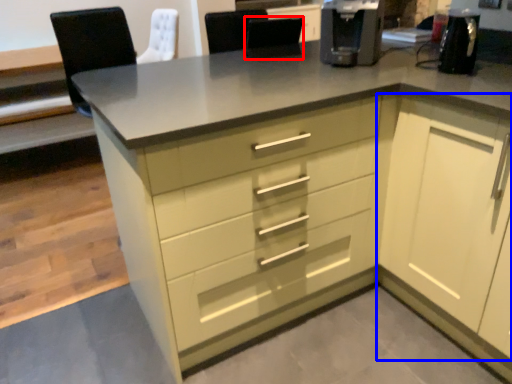
Question: Among these objects, which one is nearest to the camera, chair (highlighted by a red box) or cabinetry (highlighted by a blue box)?

Choices:
 (A) chair
 (B) cabinetry

Answer: (B)